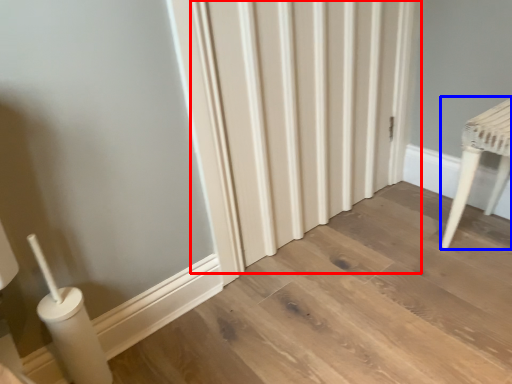
Question: Which object appears closest to the camera in this image, radiator (highlighted by a red box) or furniture (highlighted by a blue box)?

Choices:
 (A) radiator
 (B) furniture

Answer: (A)